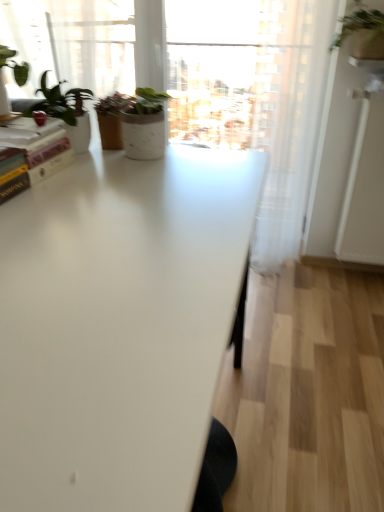
Question: Should I look upward or downward to see white glossy table at center?

Choices:
 (A) up
 (B) down

Answer: (B)

Question: Is white glossy table at center not within transparent glass window at upper center?

Choices:
 (A) no
 (B) yes

Answer: (B)

Question: Considering the relative sizes of white glossy table at center and transparent glass window at upper center in the image provided, is white glossy table at center taller than transparent glass window at upper center?

Choices:
 (A) no
 (B) yes

Answer: (B)

Question: Is white glossy table at center positioned in front of transparent glass window at upper center?

Choices:
 (A) no
 (B) yes

Answer: (B)

Question: From a real-world perspective, is white glossy table at center over transparent glass window at upper center?

Choices:
 (A) no
 (B) yes

Answer: (A)

Question: Is white glossy table at center surrounding transparent glass window at upper center?

Choices:
 (A) yes
 (B) no

Answer: (B)

Question: Can you confirm if white glossy table at center is thinner than transparent glass window at upper center?

Choices:
 (A) no
 (B) yes

Answer: (A)

Question: Is white glossy screen door at right thinner than transparent glass window at upper center?

Choices:
 (A) no
 (B) yes

Answer: (A)

Question: From the image's perspective, is white glossy screen door at right on transparent glass window at upper center?

Choices:
 (A) yes
 (B) no

Answer: (B)

Question: Is white glossy screen door at right behind transparent glass window at upper center?

Choices:
 (A) yes
 (B) no

Answer: (B)

Question: Is white glossy screen door at right shorter than transparent glass window at upper center?

Choices:
 (A) no
 (B) yes

Answer: (A)

Question: Is white glossy screen door at right bigger than transparent glass window at upper center?

Choices:
 (A) no
 (B) yes

Answer: (A)

Question: Is white glossy screen door at right outside transparent glass window at upper center?

Choices:
 (A) yes
 (B) no

Answer: (A)

Question: Is hardcover book at upper left in contact with white glossy table at center?

Choices:
 (A) yes
 (B) no

Answer: (B)